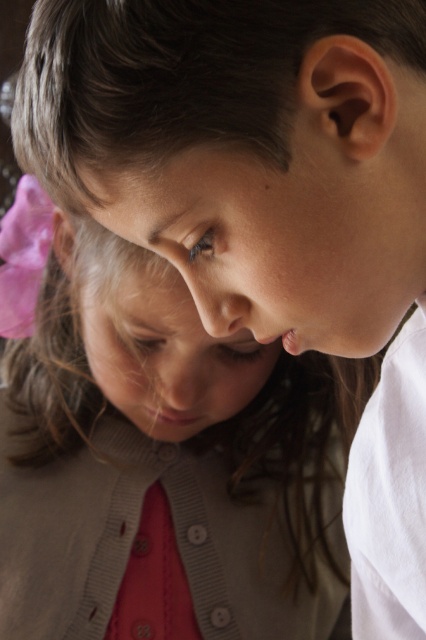
You are a photographer adjusting the lighting for a closeup shot of two children. You notice the pink fabric hairband at upper left and the matte pink bow at upper left. Which of these two items would cast a larger shadow under the current lighting setup?

The pink fabric hairband at upper left is larger in size than the matte pink bow at upper left, so it would cast a larger shadow.

You are a photographer adjusting the focus on your camera. You want to ensure that both the pink fabric hairband at upper left and the matte pink bow at upper left are in sharp focus. Which object should you focus on first to achieve this?

You should focus on the pink fabric hairband at upper left first because it is closer to the viewer than the matte pink bow at upper left, ensuring both are in focus when using depth of field properly.